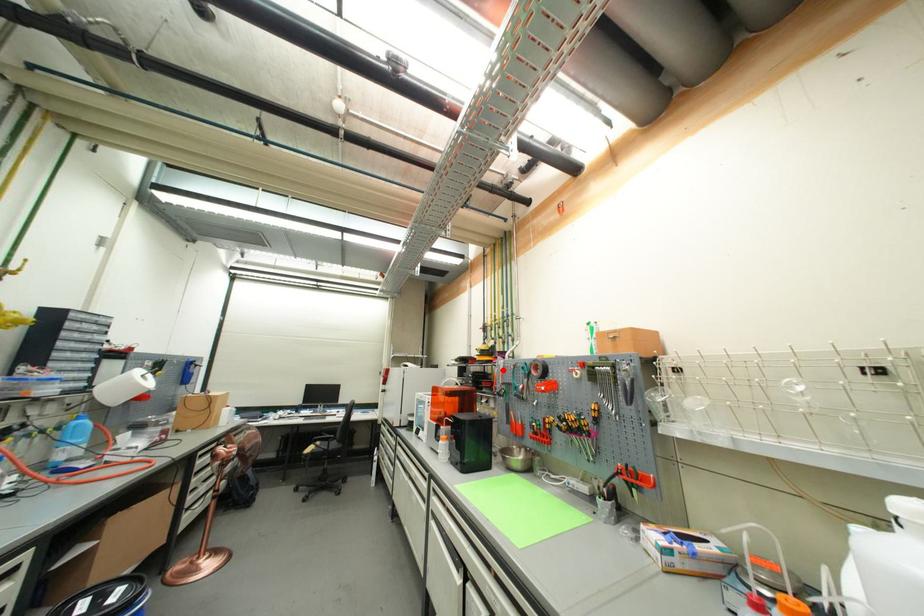
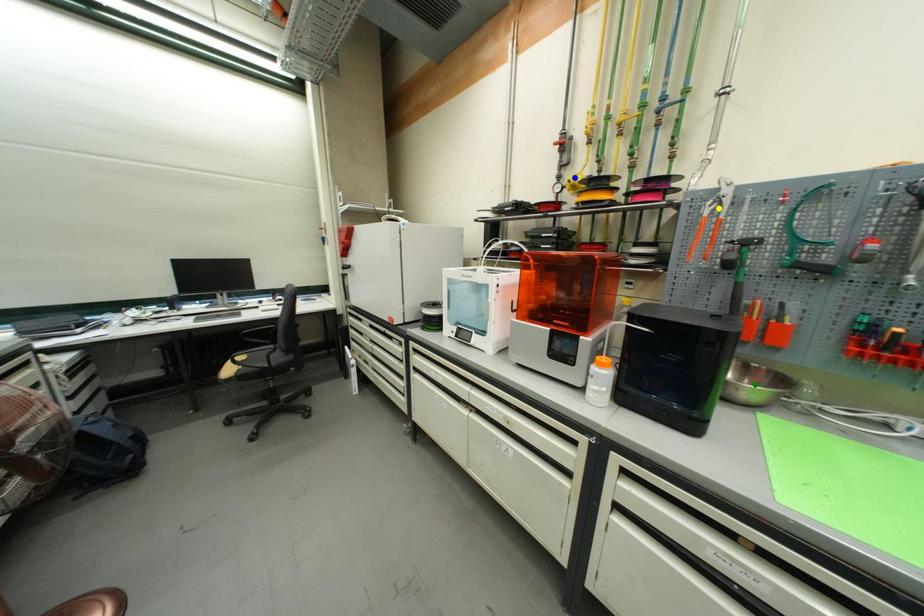
Question: I am providing you with two images of the same scene from different viewpoints. A red point is marked on the first image. You are given multiple points on the second image. Can you choose the point in image 2 that corresponds to the point in image 1?

Choices:
 (A) green point
 (B) blue point
 (C) yellow point

Answer: (C)